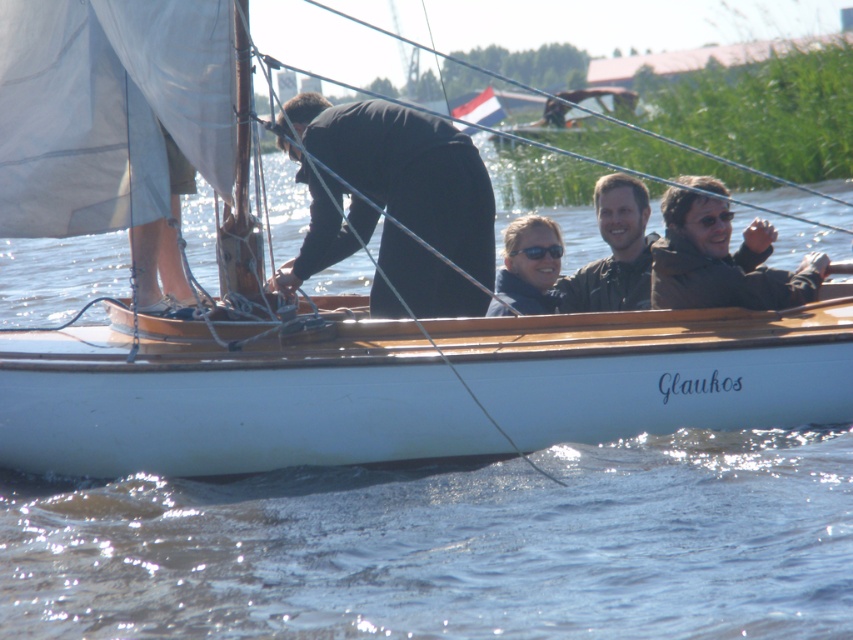
You are a passenger on the Glaukos sailboat and need to identify which clothing item is closer to you. You see a black matte suit at center and a matte black jacket at center. Which one is closer?

The black matte suit at center is closer because it is in front of the matte black jacket at center from your perspective.

You are a photographer on the dock and want to take a photo of the two individuals wearing black clothing. You notice the black matte suit at center and the matte black jacket at center. According to their positions, which one is positioned to the left?

The black matte suit at center is to the left of the matte black jacket at center, so the black matte suit at center is positioned to the left.

You are a photographer on the Glaukos sailboat trying to capture a closeup shot of the matte black jacket at center and the sunglasses matte at center in the same frame. Given that your camera has a maximum focus range of 15 inches, will you be able to fit both objects within the focus range?

The matte black jacket at center and sunglasses matte at center are 15.19 inches apart from each other. Since the distance between them exceeds the camera focus range of 15 inches, you cannot fit both objects within the focus range.